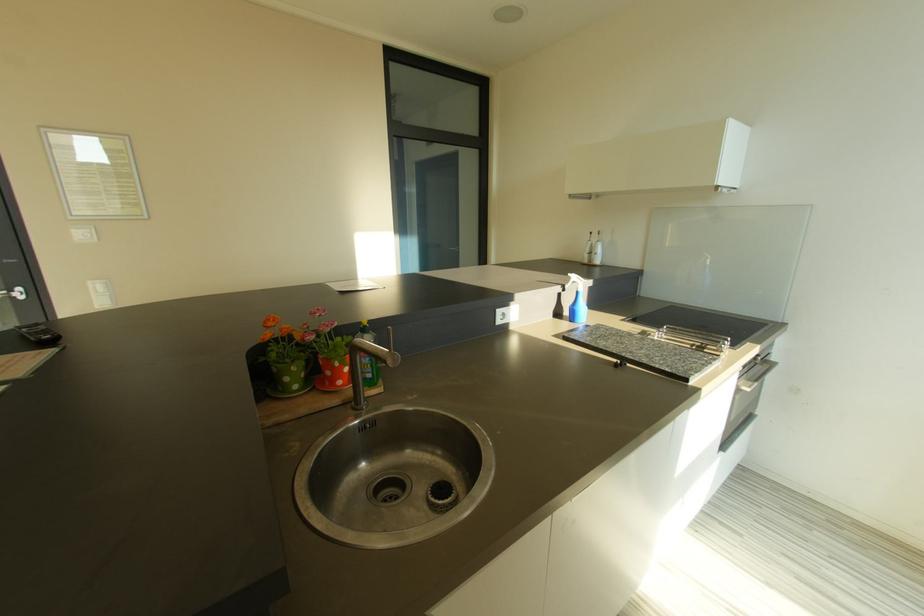
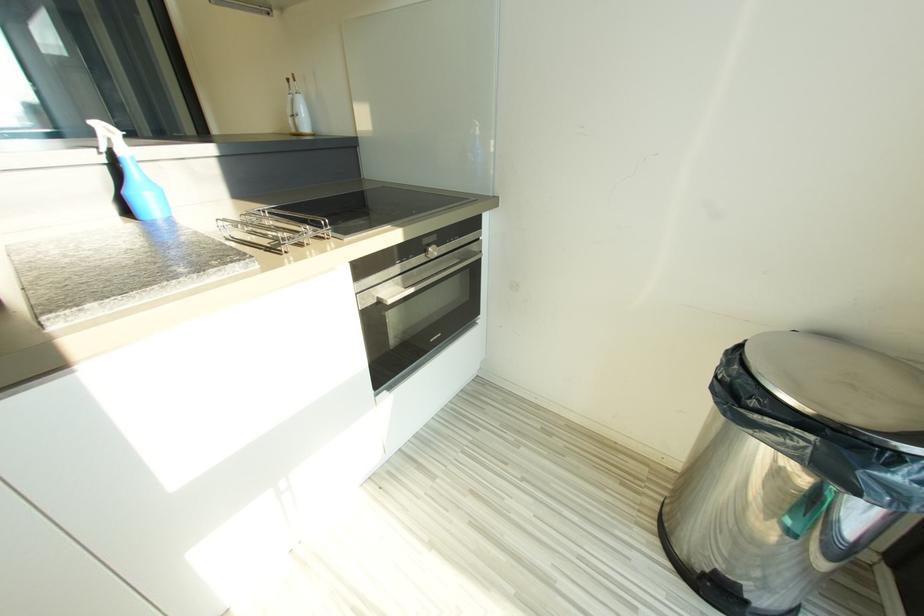
What movement of the cameraman would produce the second image?

The movement direction of the cameraman is right, forward.